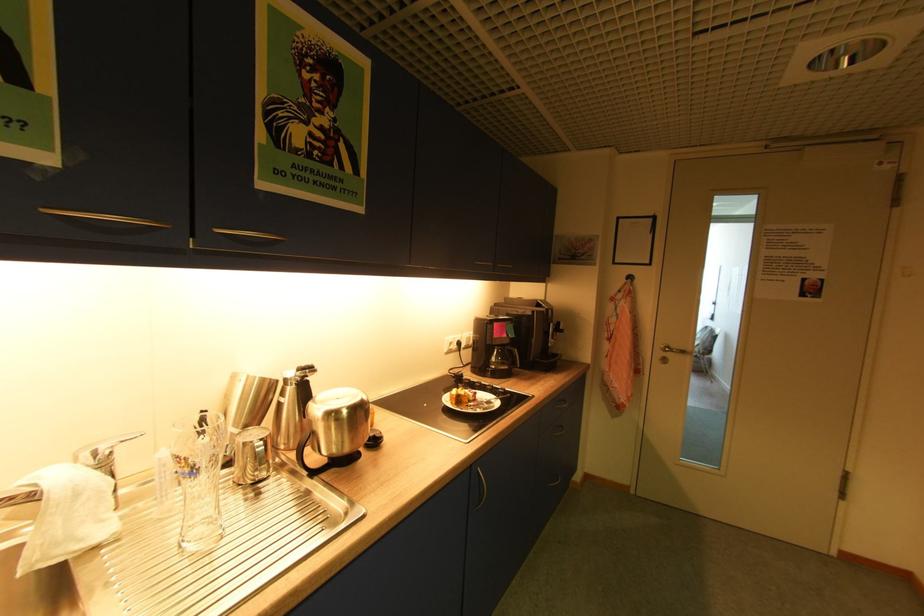
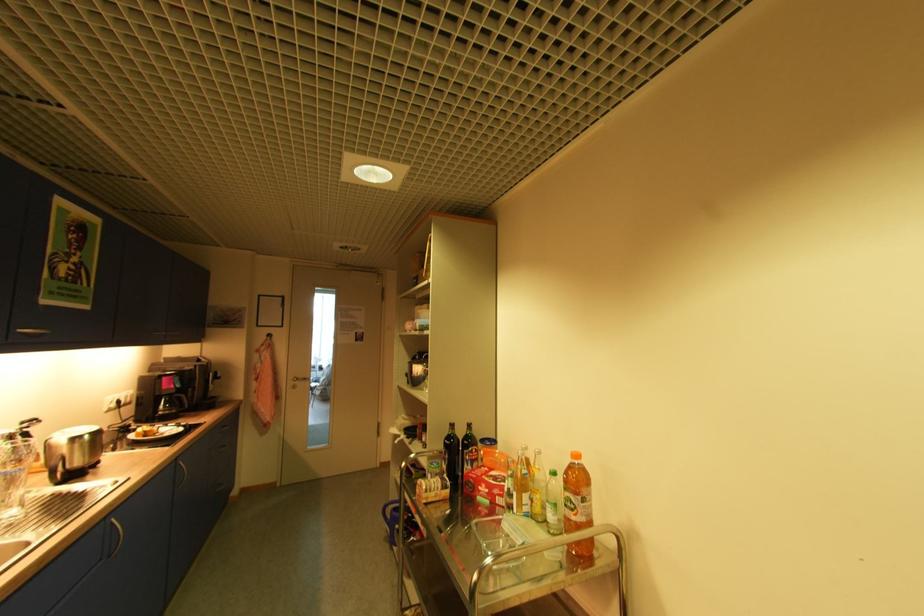
Locate, in the second image, the point that corresponds to (x=512, y=342) in the first image.

(178, 392)